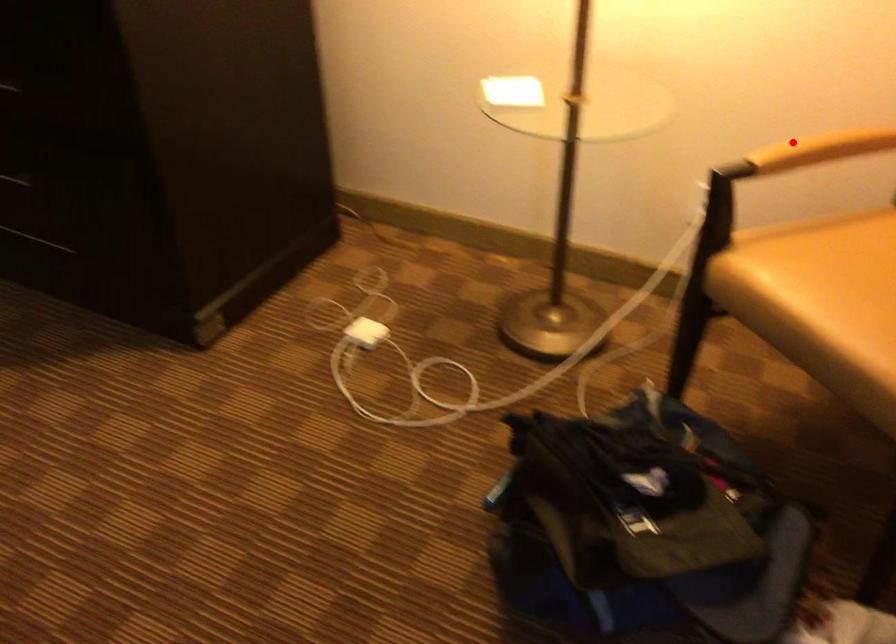
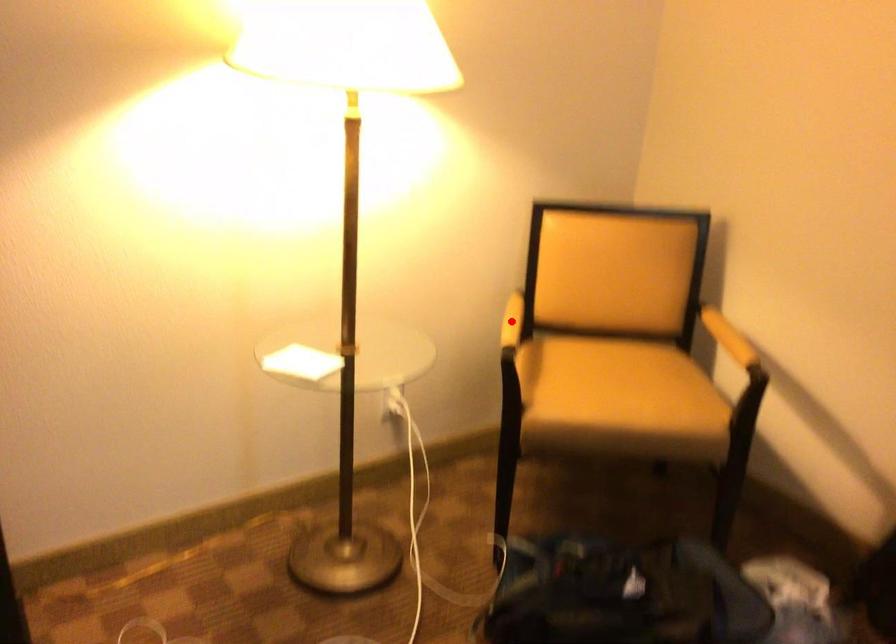
I am providing you with two images of the same scene from different viewpoints. A red point is marked on the first image and another point is marked on the second image. Is the marked point in image1 the same physical position as the marked point in image2?

Yes